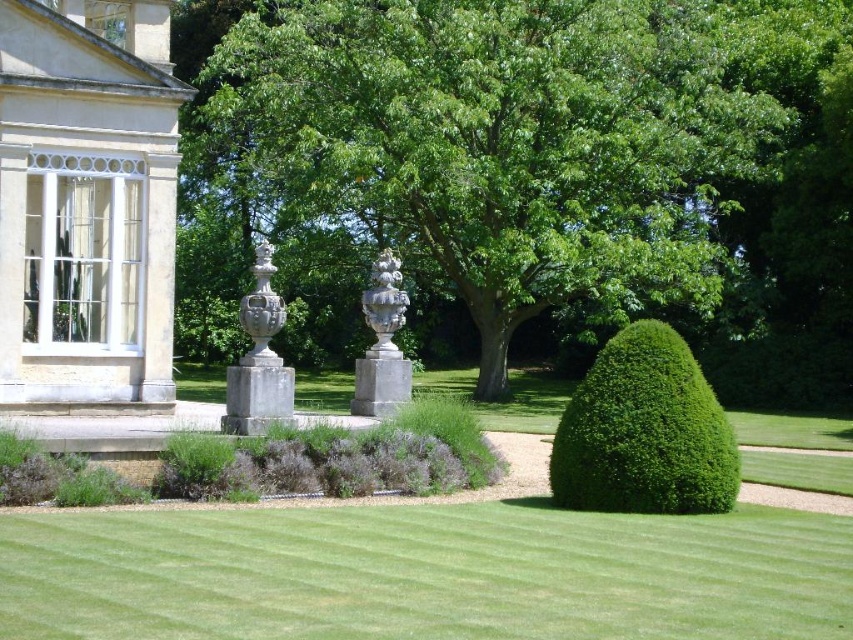
You are planning to take a photo of the green leafy tree at center and the beige stone gazebo at upper left. Which object should you focus on first if you want to capture both in a single frame without moving the camera? Explain your reasoning based on their sizes.

You should focus on the green leafy tree at center first because it is bigger than the beige stone gazebo at upper left. Since it is larger, ensuring it is centered and in focus will help frame the gazebo in the background more effectively within the same shot.

You are a gardener who needs to water both the green leafy bush at lower right and the white stone vase at center. You have a watering can that can hold enough water to cover a 5 meter radius. Starting from the bush, can you water both without moving the watering can more than 5 meters from the bush?

The green leafy bush at lower right and the white stone vase at center are 6.48 meters apart from each other. Since the distance between them exceeds the 5 meter radius of the watering can, you cannot water both without moving more than 5 meters from the bush.